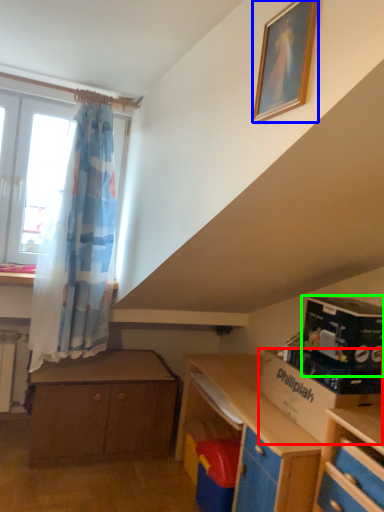
Question: Based on their relative distances, which object is nearer to cardboard box (highlighted by a red box)? Choose from picture frame (highlighted by a blue box) and box (highlighted by a green box).

Choices:
 (A) picture frame
 (B) box

Answer: (B)